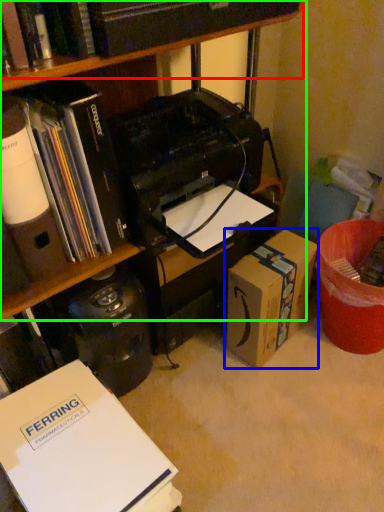
Question: Which is farther away from book (highlighted by a red box)? box (highlighted by a blue box) or bookcase (highlighted by a green box)?

Choices:
 (A) box
 (B) bookcase

Answer: (A)